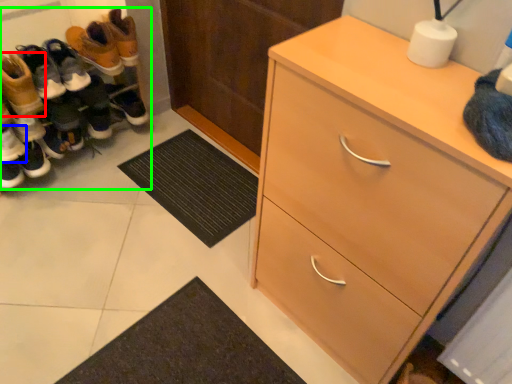
Question: Which object is the closest to the footwear (highlighted by a red box)? Choose among these: footwear (highlighted by a blue box) or footwear (highlighted by a green box).

Choices:
 (A) footwear
 (B) footwear

Answer: (A)